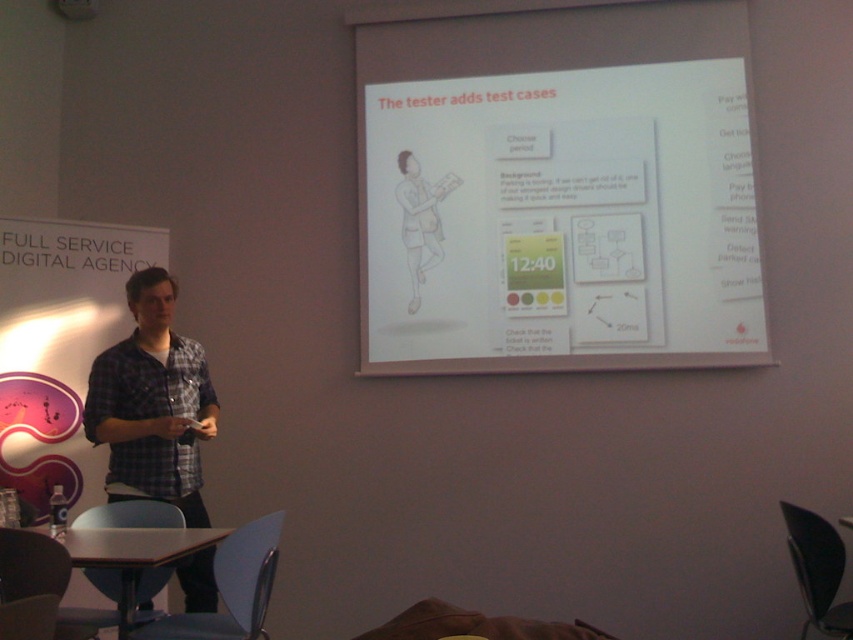
Question: Which of the following is the closest to the observer?

Choices:
 (A) white paper at upper center
 (B) matte white projector at upper center

Answer: (A)

Question: Can you confirm if white paper at upper center is positioned to the right of plaid cotton shirt at left?

Choices:
 (A) yes
 (B) no

Answer: (A)

Question: Is white paper at upper center above plaid cotton shirt at left?

Choices:
 (A) yes
 (B) no

Answer: (A)

Question: Which of these objects is positioned closest to the matte white projector at upper center?

Choices:
 (A) white paper at upper center
 (B) plaid cotton shirt at left

Answer: (A)

Question: Estimate the real-world distances between objects in this image. Which object is closer to the white paper at upper center?

Choices:
 (A) matte white projector at upper center
 (B) plaid cotton shirt at left

Answer: (B)

Question: Does white paper at upper center appear under matte white projector at upper center?

Choices:
 (A) yes
 (B) no

Answer: (A)